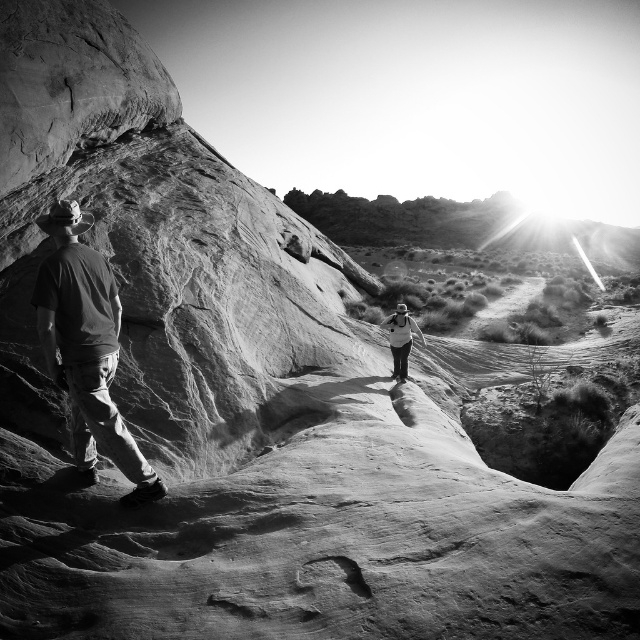
Question: Is dark gray fabric shirt at left behind white fabric backpack at center?

Choices:
 (A) no
 (B) yes

Answer: (A)

Question: Which of the following is the closest to the observer?

Choices:
 (A) (99, 392)
 (B) (396, 308)

Answer: (A)

Question: Is dark gray fabric shirt at left positioned in front of white fabric backpack at center?

Choices:
 (A) no
 (B) yes

Answer: (B)

Question: Is dark gray fabric shirt at left positioned at the back of white fabric backpack at center?

Choices:
 (A) yes
 (B) no

Answer: (B)